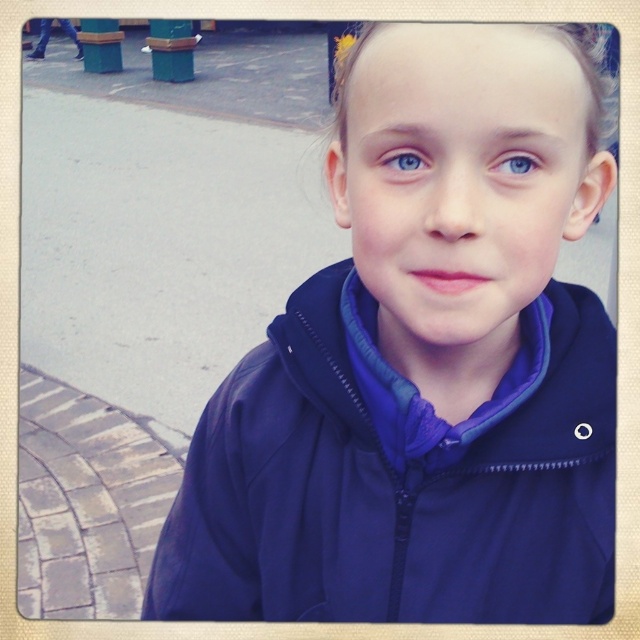
Who is more distant from viewer, (x=401, y=177) or (x=500, y=164)?

The point (x=401, y=177) is behind.

Who is more distant from viewer, (x=394, y=156) or (x=499, y=161)?

Point (x=394, y=156)

Locate an element on the screen. The height and width of the screenshot is (640, 640). blue matte eye at center is located at coordinates (404, 161).

Is the position of dark blue jacket at center more distant than that of blue matte eye at upper center?

No.

Which is more to the right, dark blue jacket at center or blue matte eye at upper center?

blue matte eye at upper center is more to the right.

Between point (467, 116) and point (534, 164), which one is positioned in front?

Point (467, 116)

At what (x,y) coordinates should I click in order to perform the action: click on dark blue jacket at center. Please return your answer as a coordinate pair (x, y). The width and height of the screenshot is (640, 640). Looking at the image, I should click on (422, 365).

Between dark blue jacket at center and blue matte eye at center, which one has more height?

With more height is dark blue jacket at center.

Is dark blue jacket at center to the right of blue matte eye at center from the viewer's perspective?

Indeed, dark blue jacket at center is positioned on the right side of blue matte eye at center.

Between point (557, 550) and point (406, 156), which one is positioned behind?

Point (557, 550)

Image resolution: width=640 pixels, height=640 pixels. I want to click on dark blue jacket at center, so click(422, 365).